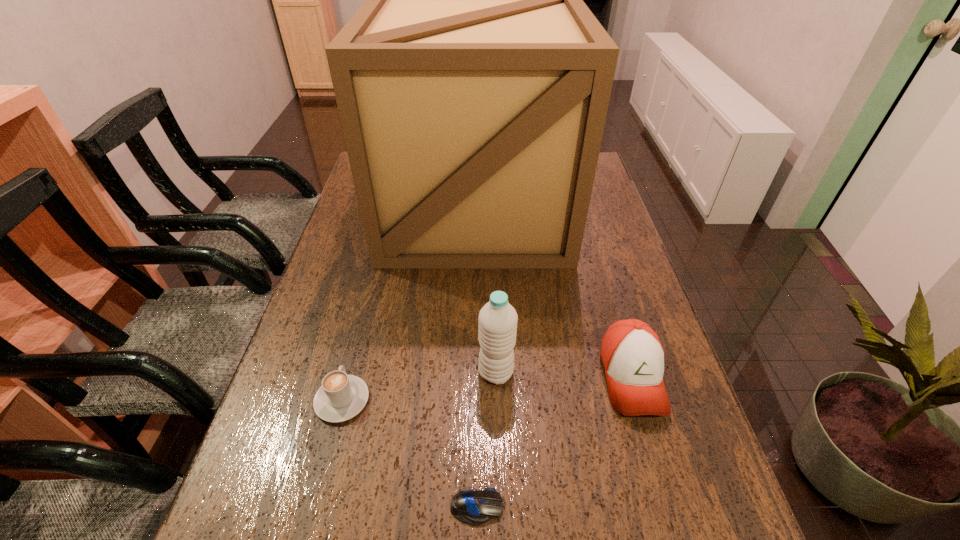
Image resolution: width=960 pixels, height=540 pixels. I want to click on the tallest object, so click(x=473, y=84).

What are the coordinates of `box` in the screenshot? It's located at (473, 84).

Locate an element on the screen. This screenshot has height=540, width=960. water bottle is located at coordinates (498, 319).

The image size is (960, 540). In order to click on the third tallest object in this screenshot , I will do `click(632, 356)`.

At what (x,y) coordinates should I click in order to perform the action: click on cappuccino. Please return your answer as a coordinate pair (x, y). Looking at the image, I should click on click(x=340, y=397).

The width and height of the screenshot is (960, 540). What are the coordinates of `computer mouse` in the screenshot? It's located at (475, 507).

The height and width of the screenshot is (540, 960). I want to click on the shortest object, so click(x=475, y=507).

Where is `free region located 0.380m on the reinforced sides of the farthest object`? free region located 0.380m on the reinforced sides of the farthest object is located at coordinates (473, 389).

Find the location of a particular element. vacant space located on the left of the water bottle is located at coordinates (432, 373).

Identify the location of free space located 0.110m on the front-facing side of the baseball cap. (662, 481).